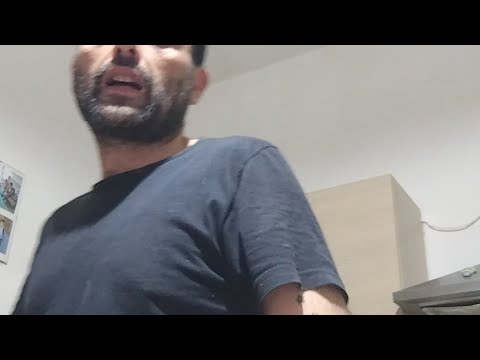
Where is `cabinet`? cabinet is located at coordinates (384, 237).